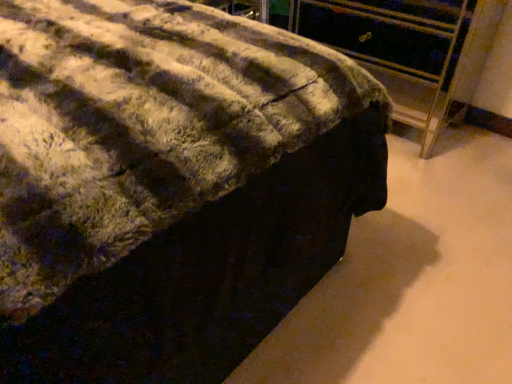
Describe the element at coordinates (410, 50) in the screenshot. This screenshot has height=384, width=512. I see `dark wood file cabinet at right` at that location.

Where is `dark wood file cabinet at right`? This screenshot has width=512, height=384. dark wood file cabinet at right is located at coordinates (410, 50).

Image resolution: width=512 pixels, height=384 pixels. I want to click on dark wood file cabinet at right, so click(410, 50).